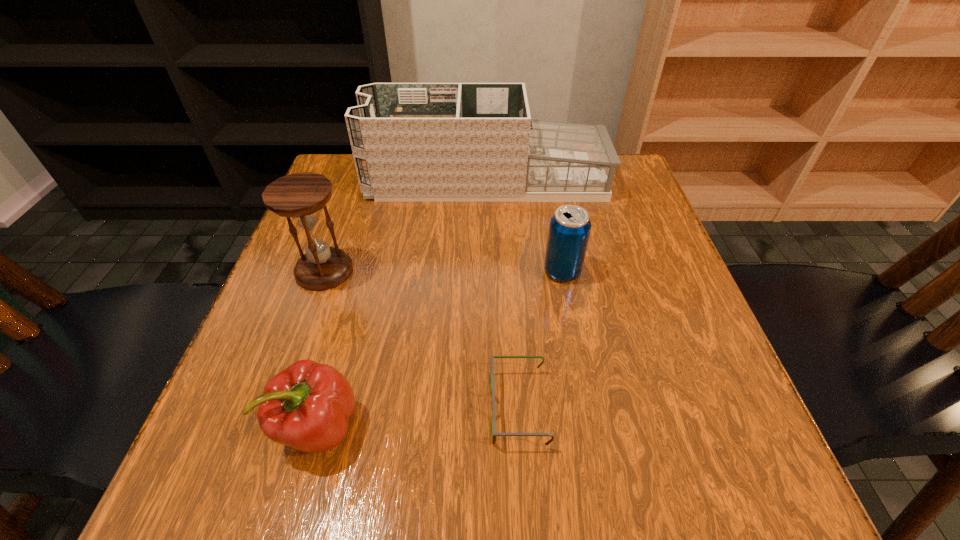
You are a GUI agent. You are given a task and a screenshot of the screen. Output one action in this format:
    pyautogui.click(x=<x>, y=<y>)
    Task: Click on the vacant space located on the lens of the shortest object
    The height and width of the screenshot is (540, 960).
    Given the screenshot: What is the action you would take?
    pyautogui.click(x=420, y=408)

The image size is (960, 540). Find the location of `free space located on the lens of the shortest object`. free space located on the lens of the shortest object is located at coordinates (373, 408).

Locate an element on the screen. This screenshot has height=540, width=960. object present at the far edge is located at coordinates (411, 142).

I want to click on pepper that is at the near edge, so click(x=307, y=406).

The width and height of the screenshot is (960, 540). Find the location of `spectacles present at the near edge`. spectacles present at the near edge is located at coordinates (494, 434).

Locate an element on the screen. dollhouse positioned at the left edge is located at coordinates (411, 142).

This screenshot has height=540, width=960. Find the location of `hourglass positioned at the left edge`. hourglass positioned at the left edge is located at coordinates (299, 195).

The image size is (960, 540). Find the location of `pepper that is at the left edge`. pepper that is at the left edge is located at coordinates (307, 406).

At what (x,y) coordinates should I click in order to perform the action: click on object that is at the right edge. Please return your answer as a coordinate pair (x, y). The height and width of the screenshot is (540, 960). Looking at the image, I should click on (411, 142).

At what (x,y) coordinates should I click in order to perform the action: click on object located at the far left corner. Please return your answer as a coordinate pair (x, y). The image size is (960, 540). Looking at the image, I should click on (x=411, y=142).